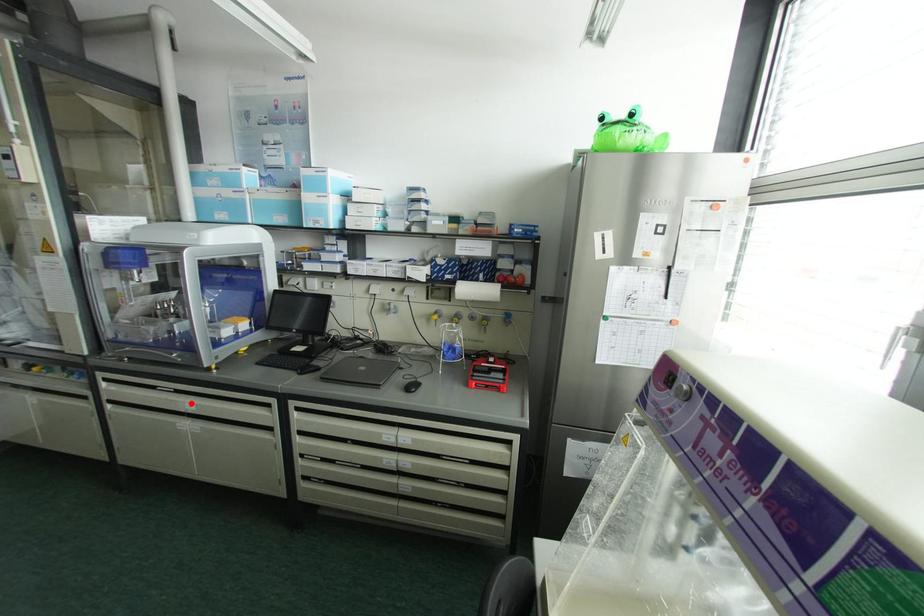
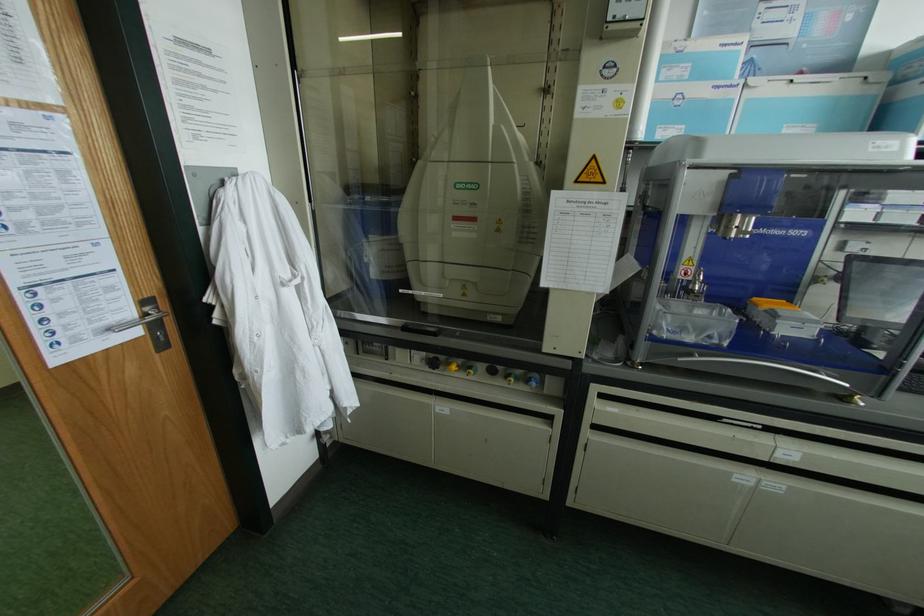
Where in the second image is the point corresponding to the highlighted location from the first image?

(789, 451)